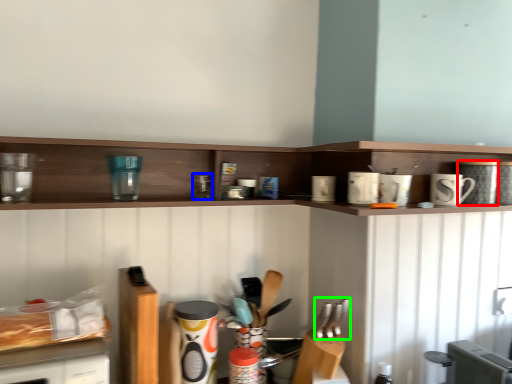
Question: Estimate the real-world distances between objects in this image. Which object is farther from appliance (highlighted by a red box), appliance (highlighted by a blue box) or silverware (highlighted by a green box)?

Choices:
 (A) appliance
 (B) silverware

Answer: (A)